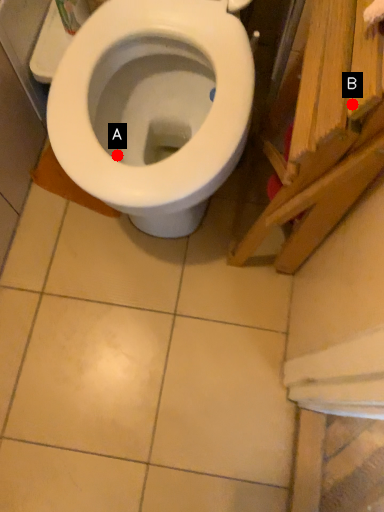
Question: Two points are circled on the image, labeled by A and B beside each circle. Which point appears farthest from the camera in this image?

Choices:
 (A) A is further
 (B) B is further

Answer: (A)